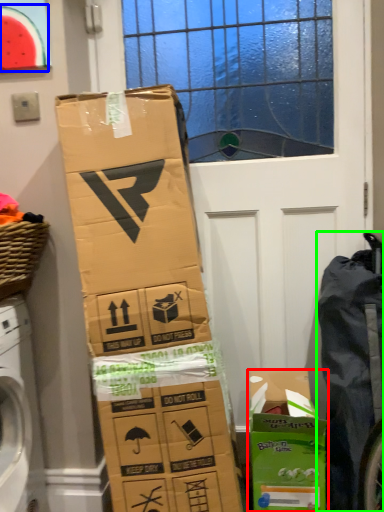
Question: Estimate the real-world distances between objects in this image. Which object is closer to cardboard box (highlighted by a red box), watermelon (highlighted by a blue box) or waste (highlighted by a green box)?

Choices:
 (A) watermelon
 (B) waste

Answer: (B)